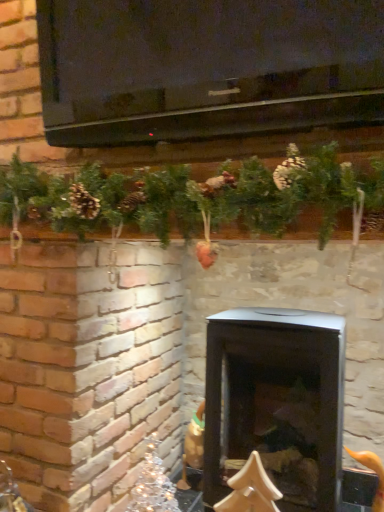
Question: In terms of height, does iridescent glass ornament at lower left look taller or shorter compared to black matte wood burning stove at center?

Choices:
 (A) tall
 (B) short

Answer: (B)

Question: From the image's perspective, relative to black matte wood burning stove at center, is iridescent glass ornament at lower left above or below?

Choices:
 (A) below
 (B) above

Answer: (A)

Question: Considering the positions of iridescent glass ornament at lower left and black matte wood burning stove at center in the image, is iridescent glass ornament at lower left bigger or smaller than black matte wood burning stove at center?

Choices:
 (A) big
 (B) small

Answer: (B)

Question: Does point (319, 493) appear closer or farther from the camera than point (150, 449)?

Choices:
 (A) farther
 (B) closer

Answer: (B)

Question: Is black matte wood burning stove at center inside or outside of iridescent glass ornament at lower left?

Choices:
 (A) inside
 (B) outside

Answer: (B)

Question: From the image's perspective, is black matte wood burning stove at center above or below iridescent glass ornament at lower left?

Choices:
 (A) above
 (B) below

Answer: (A)

Question: Based on their positions, is black matte wood burning stove at center located to the left or right of iridescent glass ornament at lower left?

Choices:
 (A) left
 (B) right

Answer: (B)